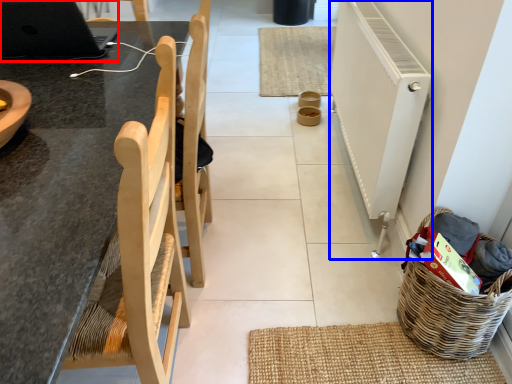
Question: Which object is further to the camera taking this photo, laptop (highlighted by a red box) or radiator (highlighted by a blue box)?

Choices:
 (A) laptop
 (B) radiator

Answer: (B)